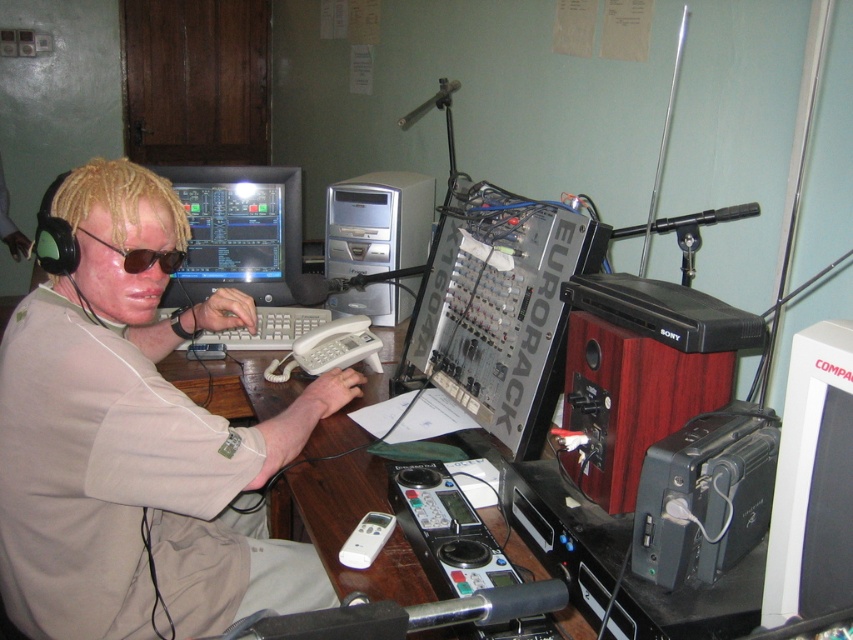
You are trying to determine which of the two points, point (x=786, y=381) or point (x=576, y=348), is nearer to you in the image. Based on the scene description, which point is closer?

Point (x=786, y=381) is closer to the camera than point (x=576, y=348), so the point closer to you is point (x=786, y=381).